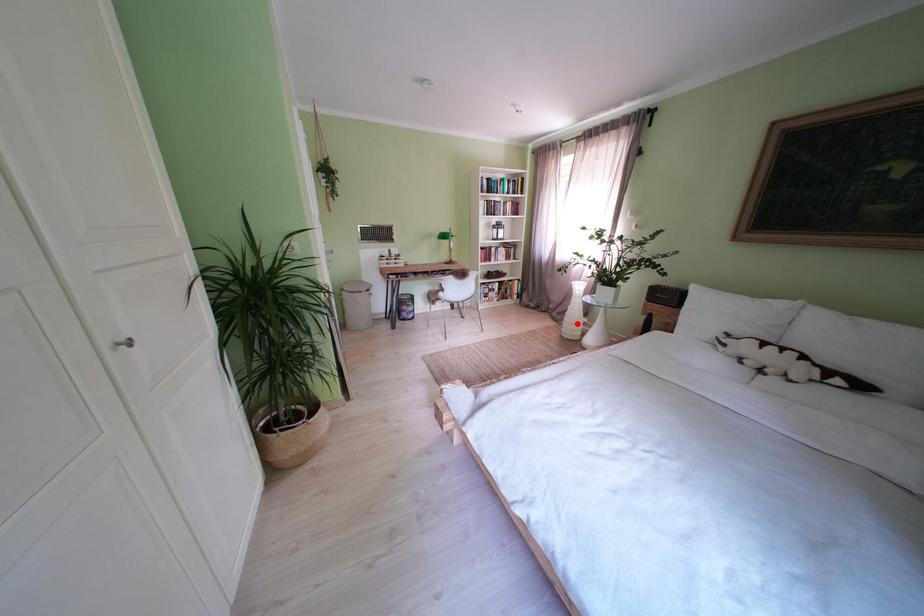
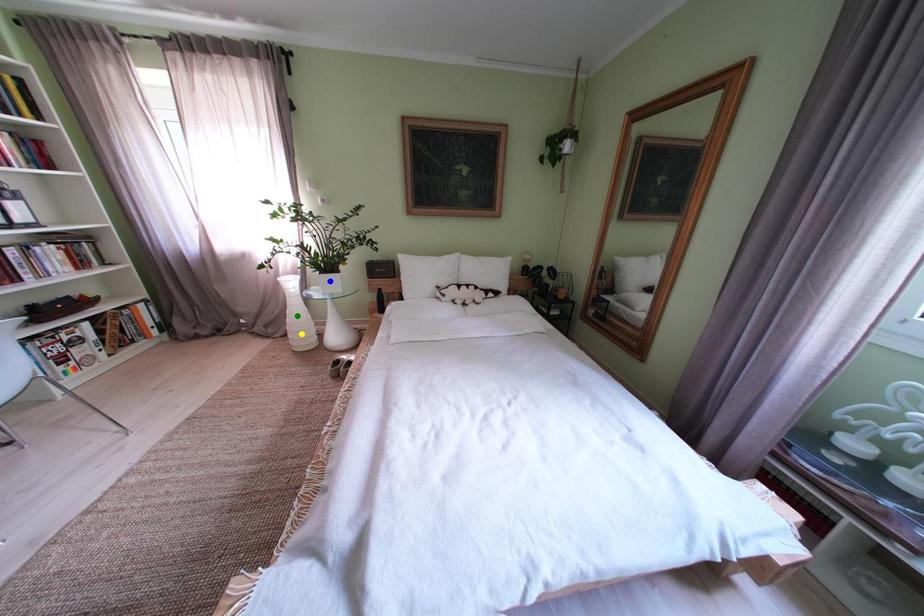
Question: I am providing you with two images of the same scene from different viewpoints. A red point is marked on the first image. You are given multiple points on the second image. Which spot in image 2 lines up with the point in image 1?

Choices:
 (A) blue point
 (B) yellow point
 (C) green point

Answer: (B)